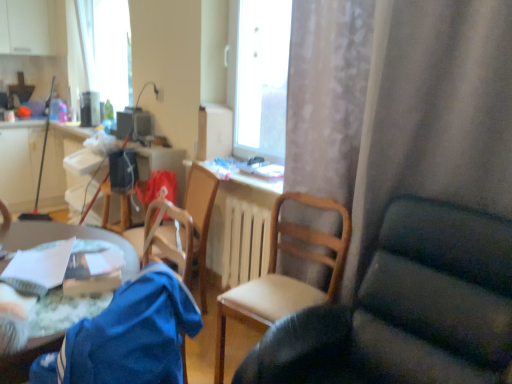
Question: Is wooden chair at center, marked as the second chair in a right-to-left arrangement, facing towards wooden radiator at center?

Choices:
 (A) no
 (B) yes

Answer: (A)

Question: From a real-world perspective, is wooden chair at center, marked as the second chair in a right-to-left arrangement, physically above wooden radiator at center?

Choices:
 (A) no
 (B) yes

Answer: (B)

Question: Does wooden chair at center, marked as the second chair in a right-to-left arrangement, lie behind wooden radiator at center?

Choices:
 (A) yes
 (B) no

Answer: (B)

Question: Can you confirm if wooden chair at center, marked as the second chair in a right-to-left arrangement, is smaller than wooden radiator at center?

Choices:
 (A) yes
 (B) no

Answer: (B)

Question: From a real-world perspective, is wooden chair at center, marked as the second chair in a right-to-left arrangement, located beneath wooden radiator at center?

Choices:
 (A) yes
 (B) no

Answer: (B)

Question: Does wooden chair at center, the 2th chair from the left, appear on the right side of wooden radiator at center?

Choices:
 (A) no
 (B) yes

Answer: (B)

Question: Does wooden chair at center, arranged as the first chair when viewed from the right, have a greater height compared to matte plastic computer desk at left?

Choices:
 (A) no
 (B) yes

Answer: (B)

Question: Considering the relative positions of wooden chair at center, arranged as the first chair when viewed from the right, and matte plastic computer desk at left in the image provided, is wooden chair at center, arranged as the first chair when viewed from the right, behind matte plastic computer desk at left?

Choices:
 (A) yes
 (B) no

Answer: (B)

Question: Is wooden chair at center, arranged as the first chair when viewed from the right, wider than matte plastic computer desk at left?

Choices:
 (A) yes
 (B) no

Answer: (A)

Question: From the image's perspective, is wooden chair at center, arranged as the first chair when viewed from the right, beneath matte plastic computer desk at left?

Choices:
 (A) yes
 (B) no

Answer: (A)

Question: Is wooden chair at center, which is the third chair from left to right, not inside matte plastic computer desk at left?

Choices:
 (A) yes
 (B) no

Answer: (A)

Question: Can you confirm if wooden chair at center, which is the third chair from left to right, is thinner than matte plastic computer desk at left?

Choices:
 (A) yes
 (B) no

Answer: (B)

Question: Is wooden radiator at center looking in the opposite direction of matte plastic computer desk at left?

Choices:
 (A) yes
 (B) no

Answer: (B)